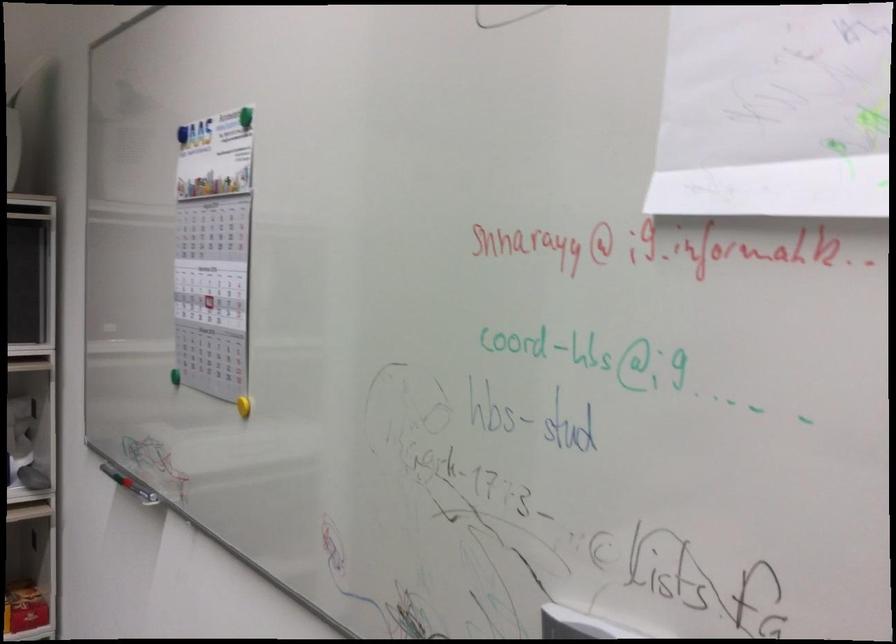
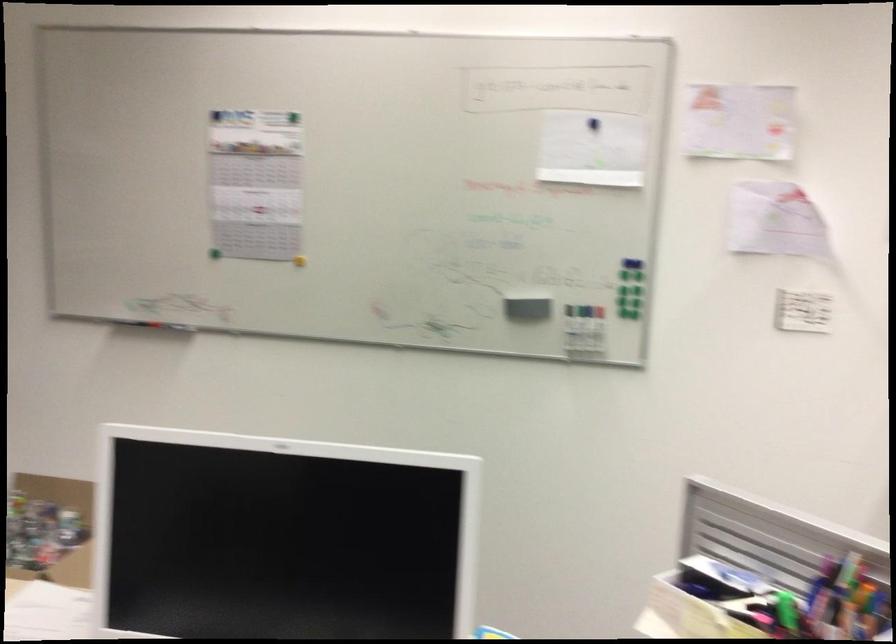
Where in the second image is the point corresponding to point 175,377 from the first image?

(213, 252)